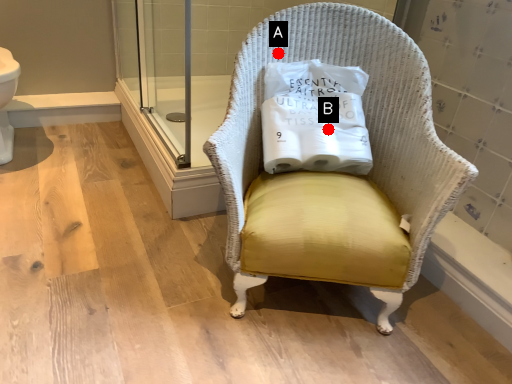
Question: Two points are circled on the image, labeled by A and B beside each circle. Which of the following is the closest to the observer?

Choices:
 (A) A is closer
 (B) B is closer

Answer: (B)